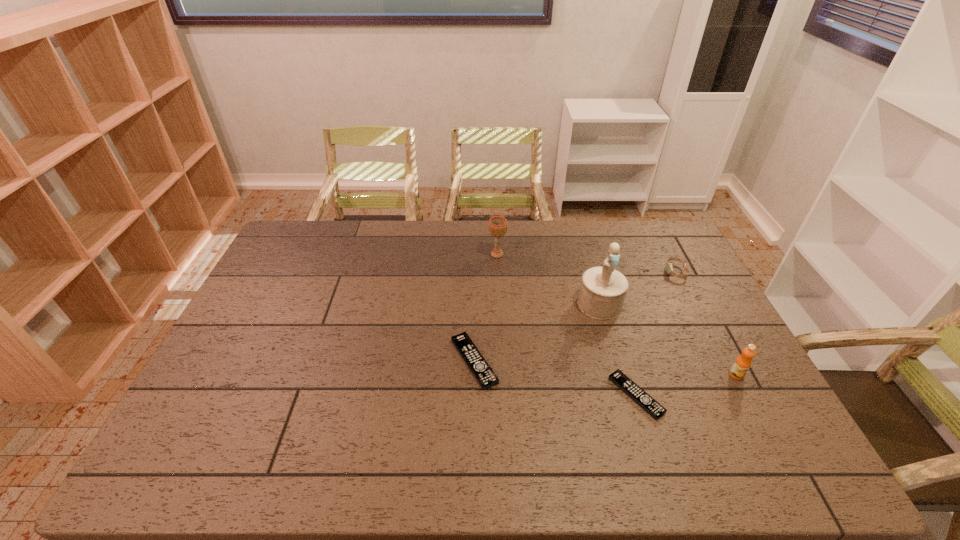
Image resolution: width=960 pixels, height=540 pixels. I want to click on the fourth shortest object, so click(x=741, y=365).

At what (x,y) coordinates should I click in order to perform the action: click on vacant space located on the back of the taller remote control. Please return your answer as a coordinate pair (x, y). This screenshot has width=960, height=540. Looking at the image, I should click on (475, 314).

Find the location of `vacant space located on the right of the shorter remote control`. vacant space located on the right of the shorter remote control is located at coordinates coord(738,395).

Where is `vacant space located on the left of the chalice`? The width and height of the screenshot is (960, 540). vacant space located on the left of the chalice is located at coordinates (414, 254).

You are a GUI agent. You are given a task and a screenshot of the screen. Output one action in this format:
    pyautogui.click(x=<x>, y=<y>)
    Task: Click on the free spot located on the face of the fifth nearest object
    This screenshot has width=960, height=540.
    Given the screenshot: What is the action you would take?
    pyautogui.click(x=609, y=272)

Locate an element on the screen. Image resolution: width=960 pixels, height=540 pixels. vacant position located on the face of the fifth nearest object is located at coordinates (617, 272).

What are the coordinates of `vacant region located 0.200m on the face of the fifth nearest object` in the screenshot? It's located at (609, 272).

Find the location of a particular element. Image resolution: width=960 pixels, height=540 pixels. vacant space located at the beak of the figurine is located at coordinates tap(611, 342).

Find the location of a particular element. free location located on the front label of the fourth shortest object is located at coordinates (756, 413).

I want to click on object located at the far edge, so click(497, 225).